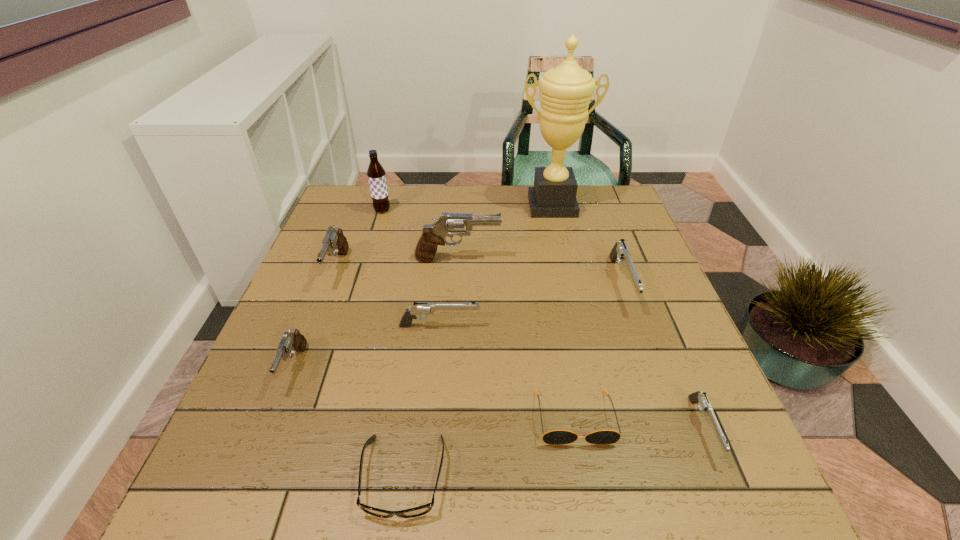
Image resolution: width=960 pixels, height=540 pixels. Find the location of `root beer present at the left edge`. root beer present at the left edge is located at coordinates (376, 175).

This screenshot has height=540, width=960. Find the location of `trophy cup situated at the right edge`. trophy cup situated at the right edge is located at coordinates (565, 91).

Identify the location of object that is at the far left corner. (376, 175).

I want to click on object positioned at the far right corner, so click(565, 91).

Locate an element on the screen. Image resolution: width=960 pixels, height=540 pixels. blank area at the far edge is located at coordinates (513, 225).

I want to click on vacant space at the left edge of the desktop, so click(318, 237).

In the image, there is a desktop. Where is `free space at the far left corner`? The height and width of the screenshot is (540, 960). free space at the far left corner is located at coordinates (326, 224).

Locate an element on the screen. This screenshot has width=960, height=540. vacant area at the near left corner of the desktop is located at coordinates (210, 487).

This screenshot has height=540, width=960. What are the coordinates of `blank space at the far right corner` in the screenshot? It's located at (614, 222).

Identify the location of vacant area at the near right corner. (712, 491).